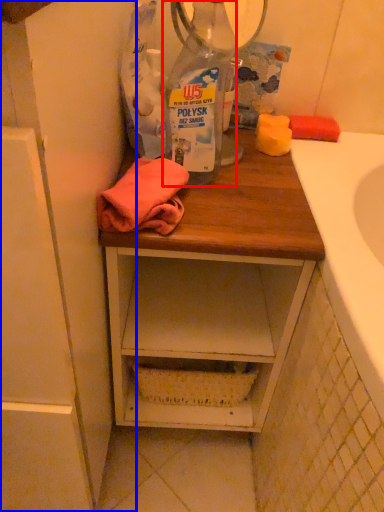
Question: Which of the following is the farthest to the observer, bottle (highlighted by a red box) or cabinetry (highlighted by a blue box)?

Choices:
 (A) bottle
 (B) cabinetry

Answer: (A)